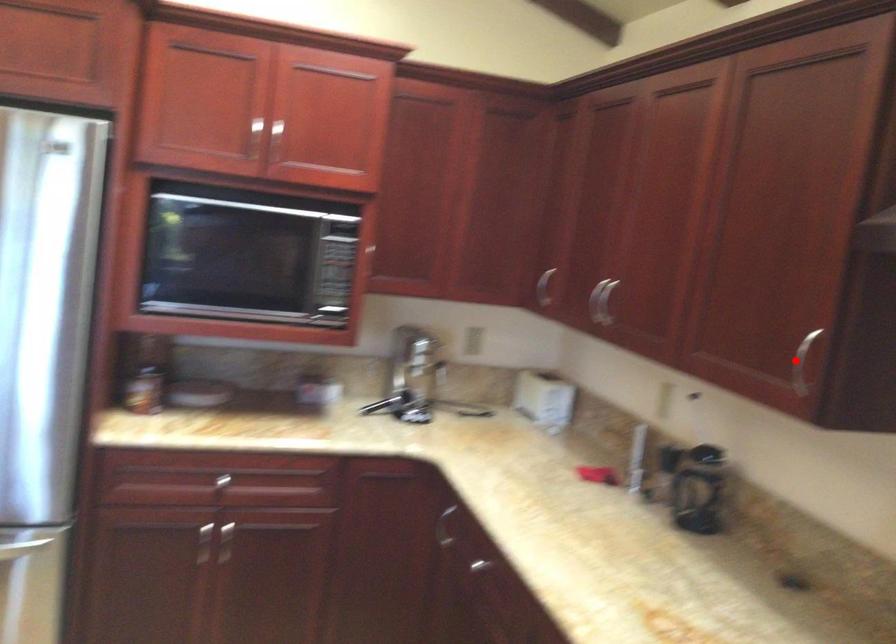
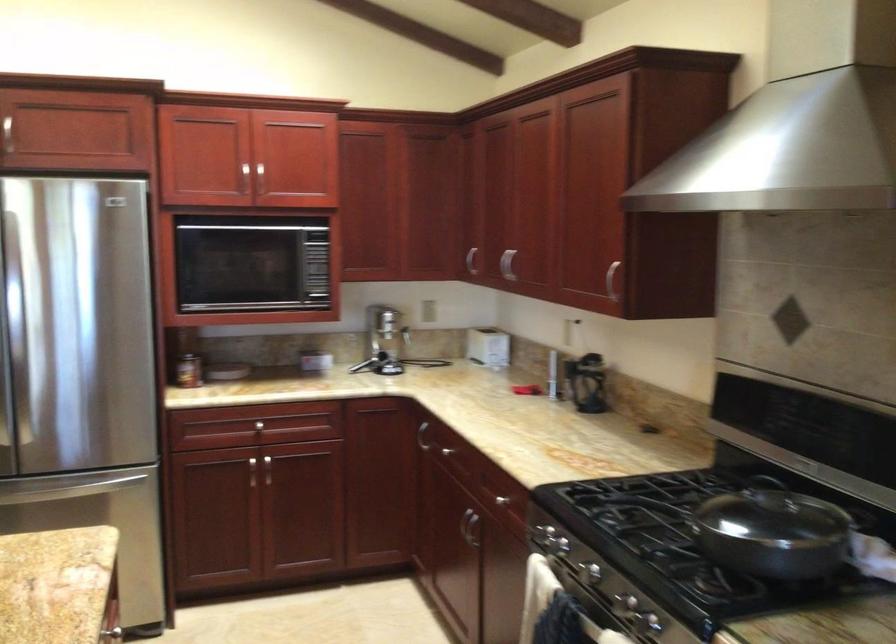
Question: I am providing you with two images of the same scene from different viewpoints. A red point is marked on the first image. Is the red point's position out of view in image 2?

Choices:
 (A) Yes
 (B) No

Answer: (B)